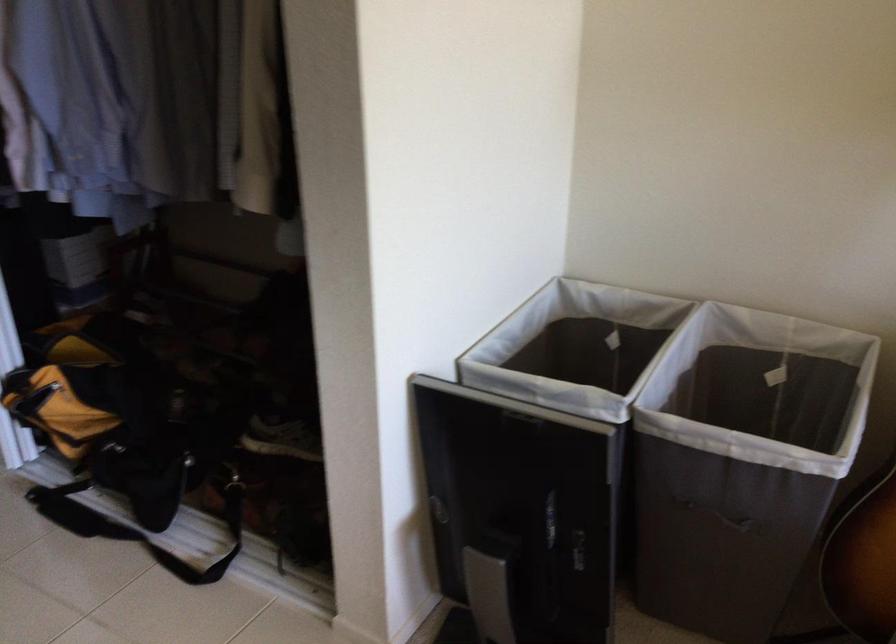
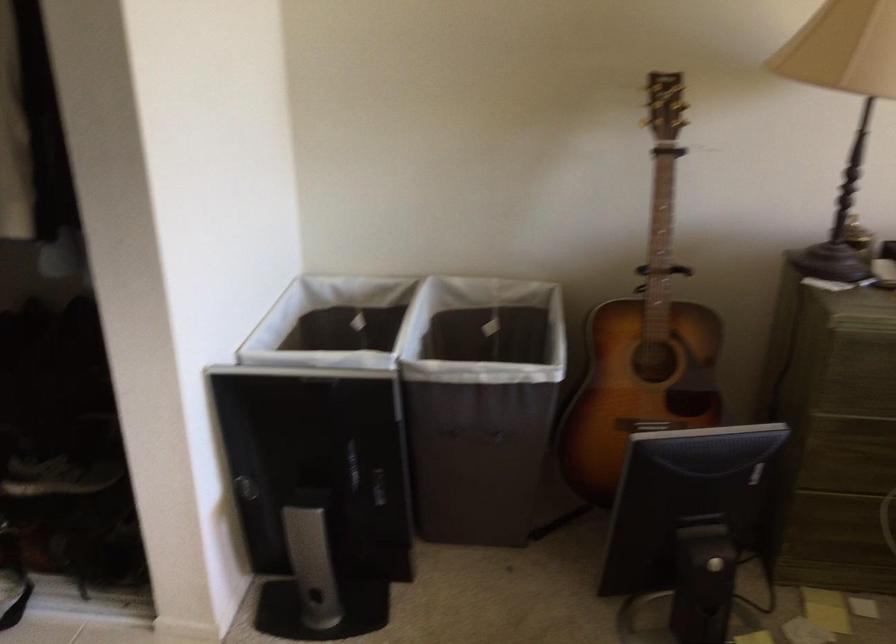
Question: How did the camera likely rotate?

Choices:
 (A) Left
 (B) Right
 (C) Up
 (D) Down

Answer: (B)